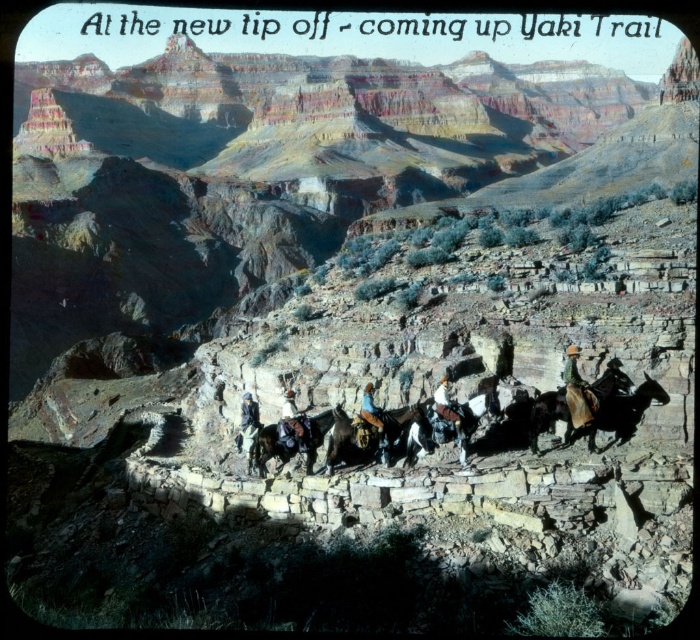
Question: Does brown leather saddle at center appear over brown leather horse at center?

Choices:
 (A) yes
 (B) no

Answer: (A)

Question: Does white glossy horse at center have a lesser width compared to brown leather jacket at center?

Choices:
 (A) yes
 (B) no

Answer: (B)

Question: Where is white glossy horse at center located in relation to blue denim jeans at center in the image?

Choices:
 (A) above
 (B) below

Answer: (B)

Question: Among these objects, which one is nearest to the camera?

Choices:
 (A) shiny brown horse at center right
 (B) leather cowboy hat at center

Answer: (A)

Question: Which object is farther from the camera taking this photo?

Choices:
 (A) leather jacket at center
 (B) white glossy horse at center
 (C) shiny brown horse at center right
 (D) white leather boots at center

Answer: (A)

Question: Among these objects, which one is farthest from the camera?

Choices:
 (A) shiny brown horse at center right
 (B) leather cowboy hat at center
 (C) brown leather jacket at center
 (D) leather jacket at center

Answer: (D)